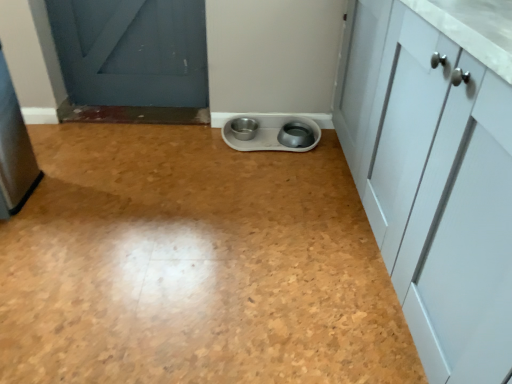
Question: In terms of height, does white plastic pet bowls at center look taller or shorter compared to brushed metal refrigerator at left, marked as the first appliance in a left-to-right arrangement?

Choices:
 (A) tall
 (B) short

Answer: (B)

Question: Based on their positions, is white plastic pet bowls at center located to the left or right of brushed metal refrigerator at left, marked as the second appliance in a right-to-left arrangement?

Choices:
 (A) left
 (B) right

Answer: (B)

Question: Which object is positioned farthest from the white plastic pet bowls at center?

Choices:
 (A) brushed metal refrigerator at left, marked as the first appliance in a left-to-right arrangement
 (B) metallic gray bowls at center, the second appliance in the left-to-right sequence

Answer: (B)

Question: Estimate the real-world distances between objects in this image. Which object is farther from the brushed metal refrigerator at left, the 2th appliance when ordered from back to front?

Choices:
 (A) white plastic pet bowls at center
 (B) metallic gray bowls at center, the second appliance in the left-to-right sequence

Answer: (B)